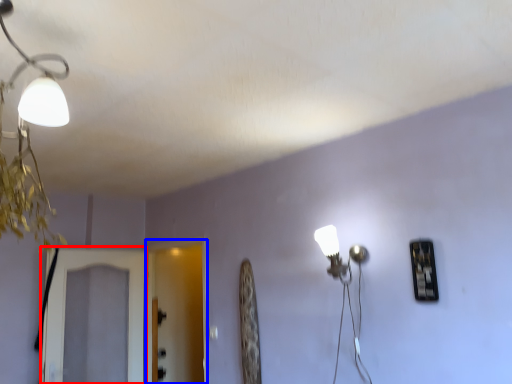
Question: Which object appears farthest to the camera in this image, screen door (highlighted by a red box) or screen door (highlighted by a blue box)?

Choices:
 (A) screen door
 (B) screen door

Answer: (B)